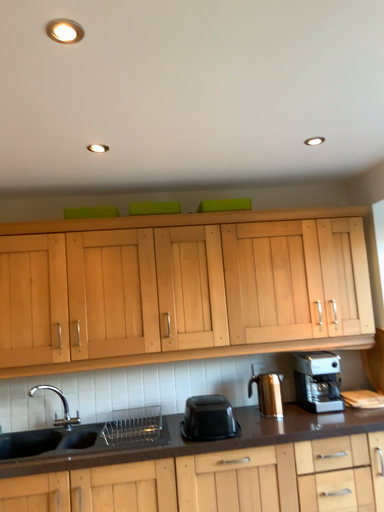
Question: Is point (319, 361) positioned closer to the camera than point (29, 392)?

Choices:
 (A) farther
 (B) closer

Answer: (B)

Question: In the image, is silver metallic coffee maker at lower right on the left side or the right side of black matte sink at lower left?

Choices:
 (A) left
 (B) right

Answer: (B)

Question: Which is farther from the black plastic container at center?

Choices:
 (A) shiny metallic coffee maker at right
 (B) black matte sink at lower left
 (C) silver metallic coffee maker at lower right

Answer: (C)

Question: Estimate the real-world distances between objects in this image. Which object is closer to the black plastic container at center?

Choices:
 (A) shiny metallic coffee maker at right
 (B) silver metallic coffee maker at lower right
 (C) black matte sink at lower left

Answer: (A)